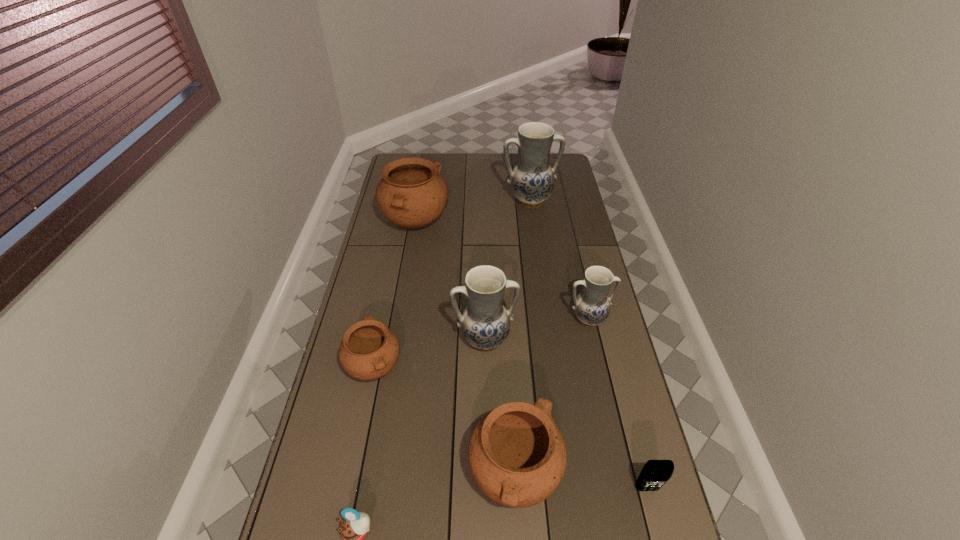
The image size is (960, 540). I want to click on the biggest blue pottery, so click(532, 179).

Locate an element on the screen. This screenshot has height=540, width=960. the tallest object is located at coordinates (532, 179).

The width and height of the screenshot is (960, 540). What are the coordinates of `the second biggest blue pottery` in the screenshot? It's located at (485, 323).

Identify the location of the biggest terracotta pottery. Image resolution: width=960 pixels, height=540 pixels. (412, 194).

Locate an element on the screen. the smallest blue pottery is located at coordinates (592, 306).

Where is `the rightmost terracotta pottery`? the rightmost terracotta pottery is located at coordinates (517, 455).

Where is `the second smallest terracotta pottery`? the second smallest terracotta pottery is located at coordinates (517, 455).

Where is `the shortest pottery`? The image size is (960, 540). the shortest pottery is located at coordinates (369, 350).

This screenshot has width=960, height=540. Identify the location of the second farthest terracotta pottery. [369, 350].

At what (x,y) coordinates should I click in order to perform the action: click on cellular telephone. Please return your answer as a coordinate pair (x, y). The width and height of the screenshot is (960, 540). Looking at the image, I should click on (655, 473).